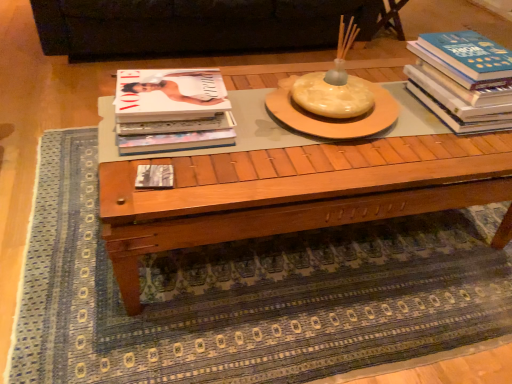
You are a GUI agent. You are given a task and a screenshot of the screen. Output one action in this format:
    pyautogui.click(x=<x>, y=<y>)
    Task: Click on the free spot in front of blue hardcover book at right, which appears as the first book when viewed from the right
    
    Given the screenshot: What is the action you would take?
    pyautogui.click(x=453, y=151)